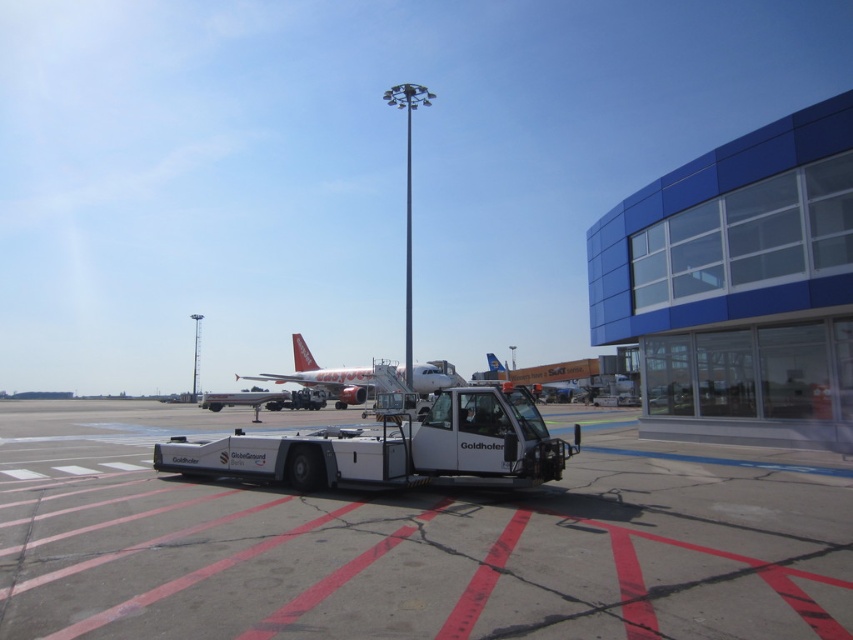
Which of these two, white rubber tarmac at center or white matte tow truck at center, stands taller?

white rubber tarmac at center

Can you confirm if white rubber tarmac at center is positioned above white matte tow truck at center?

No, white rubber tarmac at center is not above white matte tow truck at center.

At what (x,y) coordinates should I click in order to perform the action: click on white rubber tarmac at center. Please return your answer as a coordinate pair (x, y). The width and height of the screenshot is (853, 640). Looking at the image, I should click on (410, 545).

Who is lower down, white matte tow truck at center or matte red airplane at center?

matte red airplane at center is lower down.

Is point (399, 429) behind point (297, 342)?

No.

Where is `white matte tow truck at center`? white matte tow truck at center is located at coordinates (393, 449).

Does white rubber tarmac at center have a lesser height compared to matte red airplane at center?

Yes, white rubber tarmac at center is shorter than matte red airplane at center.

Which of these two, white rubber tarmac at center or matte red airplane at center, stands taller?

Standing taller between the two is matte red airplane at center.

Who is more distant from viewer, (376,602) or (306,349)?

The point (306,349) is more distant.

Where is `white rubber tarmac at center`? white rubber tarmac at center is located at coordinates 410,545.